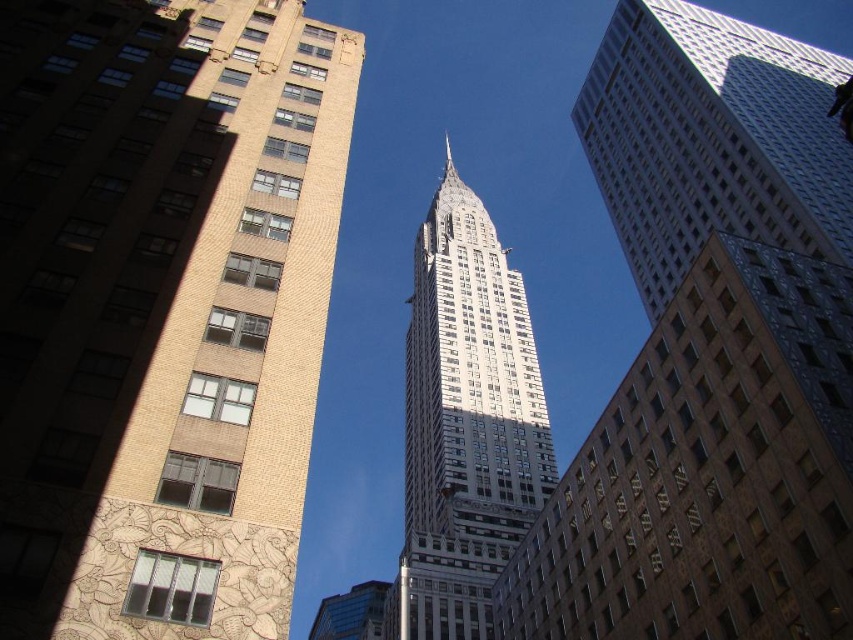
Based on the scene description, which object is larger in size between the white glass skyscraper at center and the white glass tower at center?

The white glass tower at center is larger than the white glass skyscraper at center according to the description.

You are a drone operator tasked with flying a drone between the white glass tower at center and the blue glass building at center. The drone has a maximum flight distance of 50 meters. Can you safely fly the drone between them without exceeding its range?

The white glass tower at center and blue glass building at center are 55.83 meters apart, which exceeds the drone maximum flight distance of 50 meters. Therefore, the drone cannot safely fly between them without exceeding its range.